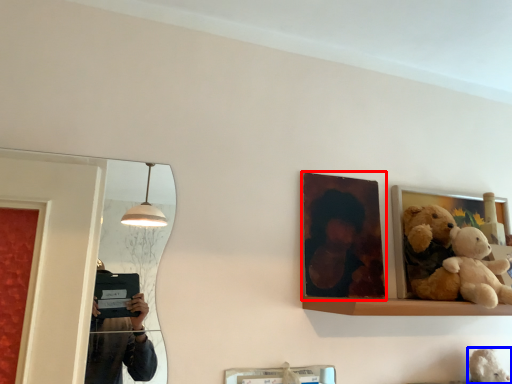
Question: Which object appears farthest to the camera in this image, picture frame (highlighted by a red box) or teddy (highlighted by a blue box)?

Choices:
 (A) picture frame
 (B) teddy

Answer: (A)